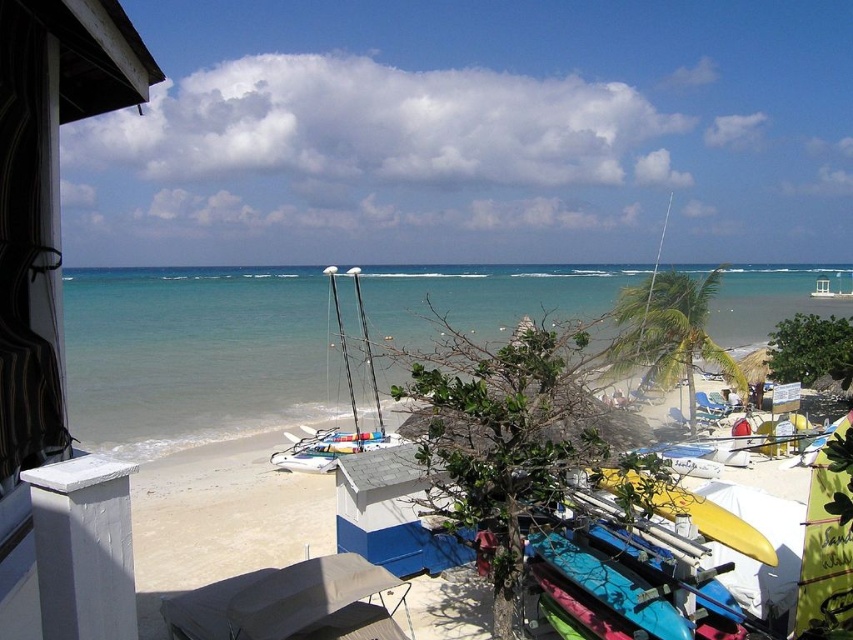
You are standing on the beach and see the clear blue water at center and the white painted wood at left. Which object is located to the right of the other?

The clear blue water at center is to the right of the white painted wood at left.

You are a photographer planning to capture the clear blue water at center and the yellow surfboard at center in a single shot. Which object will appear taller in the photo?

The clear blue water at center appears taller in the photo because it has a greater height compared to the yellow surfboard at center.